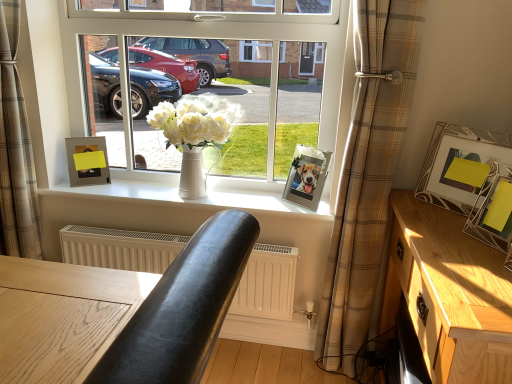
The height and width of the screenshot is (384, 512). Identify the location of vacant space underneath white ceramic vase at center (from a real-world perspective). (186, 198).